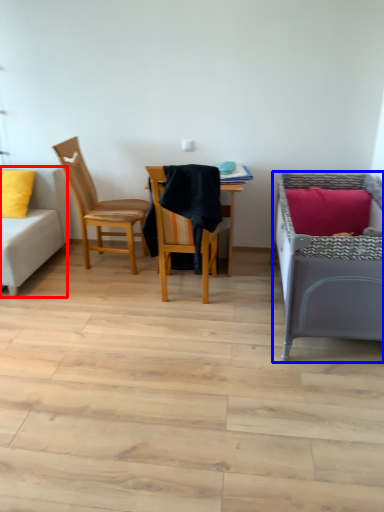
Question: Which point is closer to the camera, studio couch (highlighted by a red box) or infant bed (highlighted by a blue box)?

Choices:
 (A) studio couch
 (B) infant bed

Answer: (B)